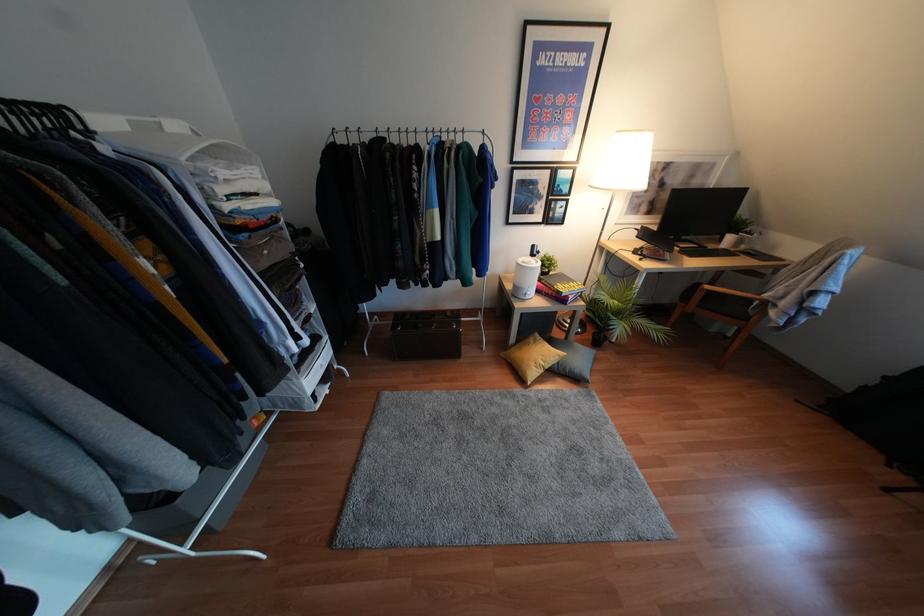
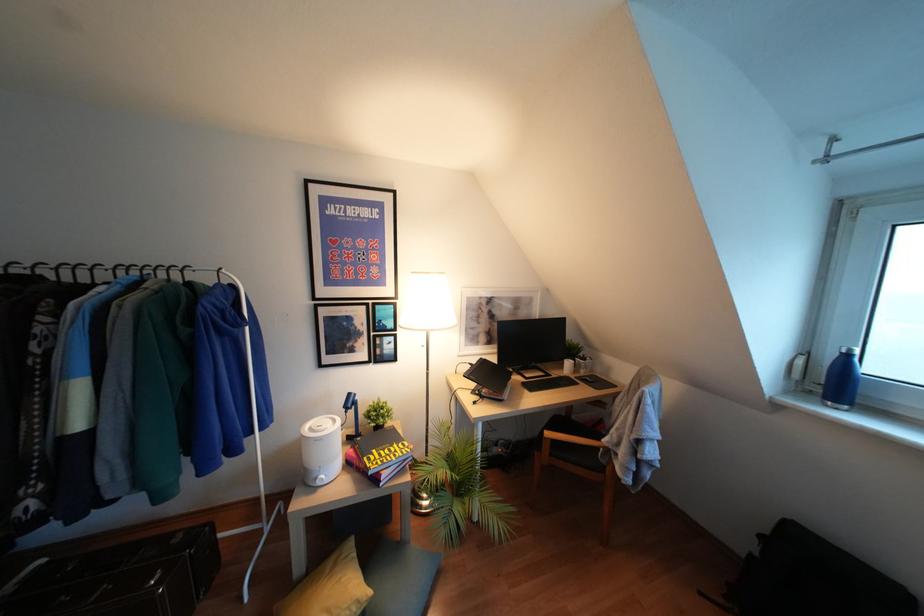
Question: The images are taken continuously from a first-person perspective. In which direction are you moving?

Choices:
 (A) Left
 (B) Right
 (C) Forward
 (D) Backward

Answer: (B)